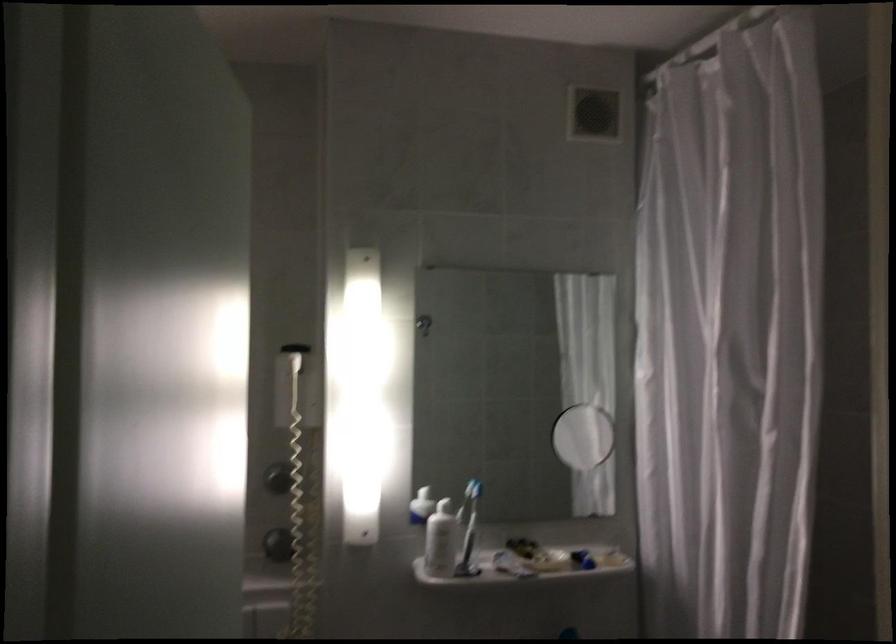
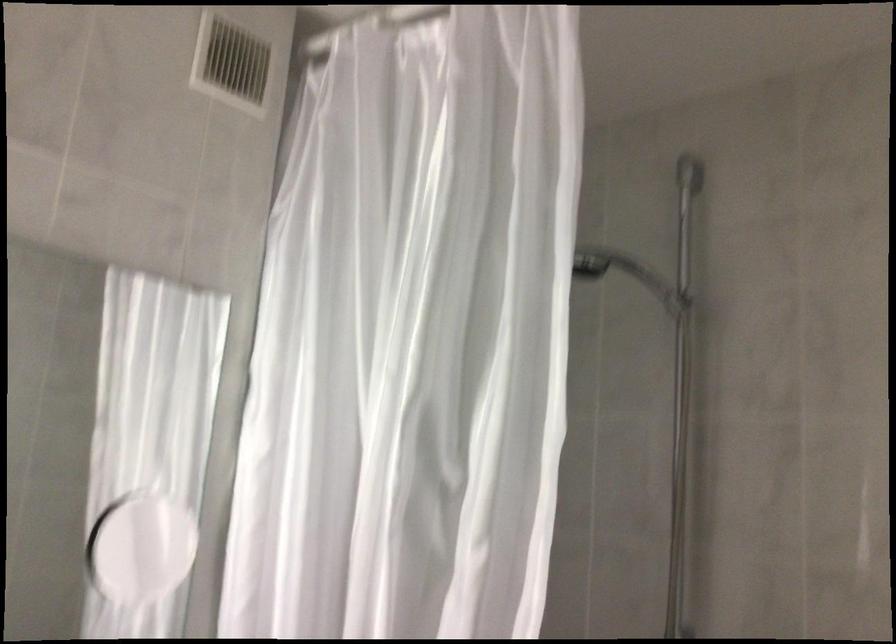
In the second image, find the point that corresponds to point 719,292 in the first image.

(412, 337)